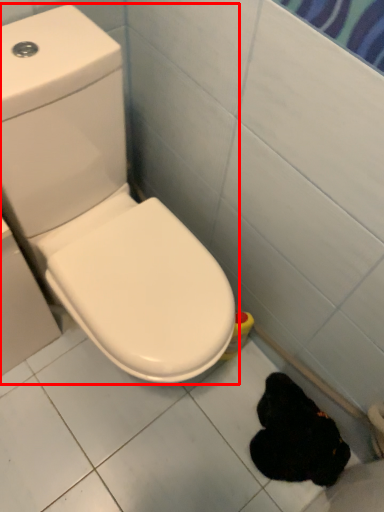
Question: From the image's perspective, where is toilet (annotated by the red box) located in relation to animal in the image?

Choices:
 (A) below
 (B) above

Answer: (B)